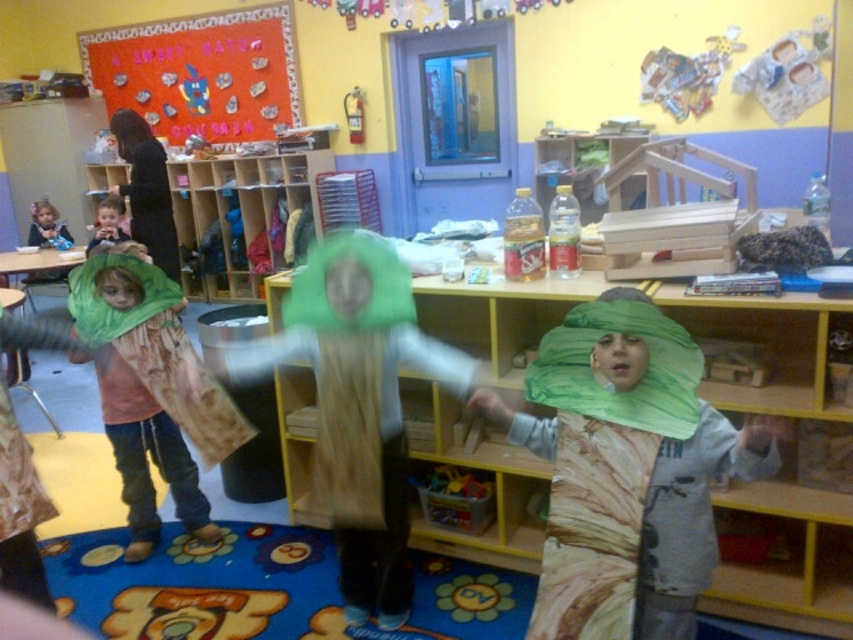
You are a teacher in the classroom and want to store the green fabric tree at left and the green fabric headband at upper center in a storage box. If the box can only fit one of them, which object should you choose to store first based on their sizes?

The green fabric tree at left is larger in size than the green fabric headband at upper center, so you should store the green fabric headband at upper center first since it takes up less space.

You are standing in the classroom looking at the bulletin board on the left wall. There is a point marked at coordinates (625, 470). What object is located at that point?

The point at coordinates (625, 470) marks the location of the matte green leaf at center.